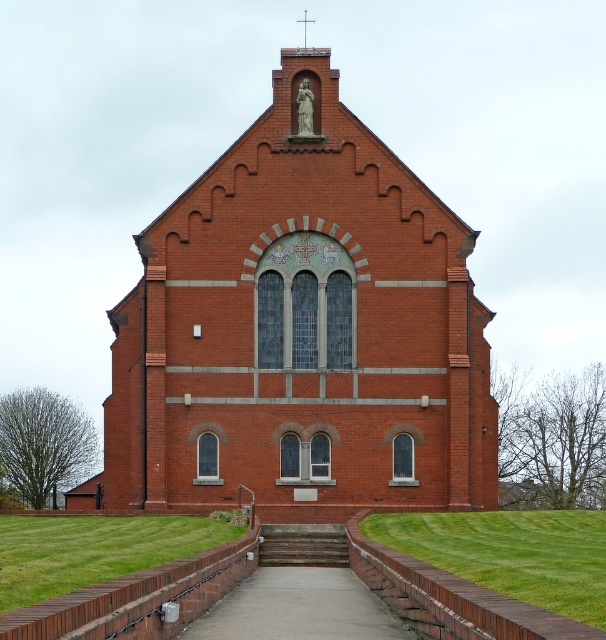
Is point (132, 396) positioned before point (324, 563)?

No, (132, 396) is further to viewer.

The height and width of the screenshot is (640, 606). Describe the element at coordinates (301, 332) in the screenshot. I see `red brick church at center` at that location.

Where is `red brick church at center`? This screenshot has height=640, width=606. red brick church at center is located at coordinates (301, 332).

Is red brick church at center above concrete at center?

Correct, red brick church at center is located above concrete at center.

Is red brick church at center shorter than concrete at center?

No.

Measure the distance between red brick church at center and camera.

A distance of 290.32 feet exists between red brick church at center and camera.

At what (x,y) coordinates should I click in order to perform the action: click on red brick church at center. Please return your answer as a coordinate pair (x, y). The height and width of the screenshot is (640, 606). Looking at the image, I should click on (301, 332).

Which is in front, point (342, 637) or point (327, 561)?

Point (342, 637)

Identify the location of concrete at center. The image size is (606, 640). (298, 609).